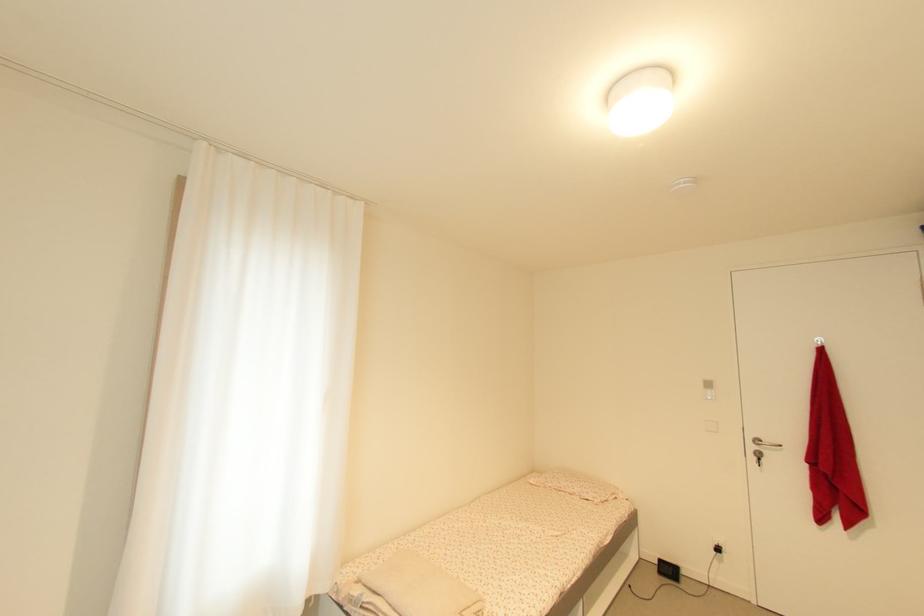
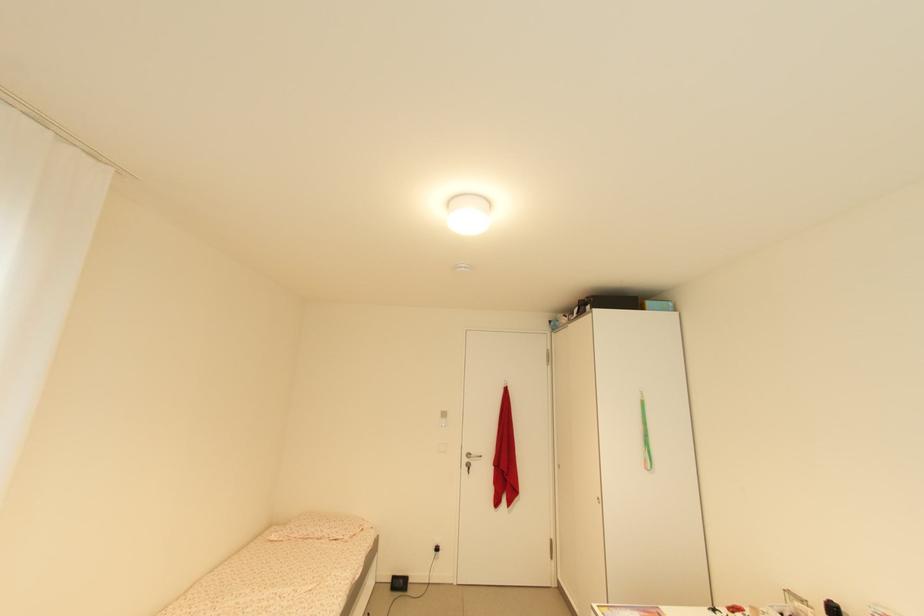
The point at (685, 185) is marked in the first image. Where is the corresponding point in the second image?

(467, 268)